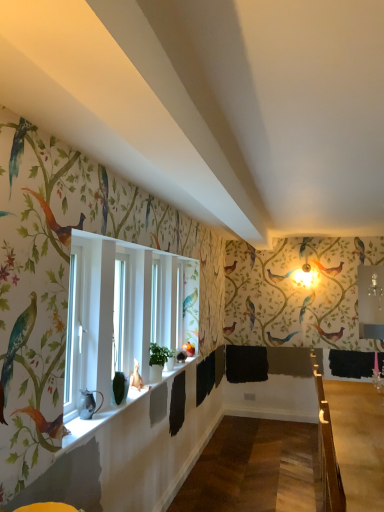
I want to click on free space to the back side of matte black pitcher at window, so click(98, 413).